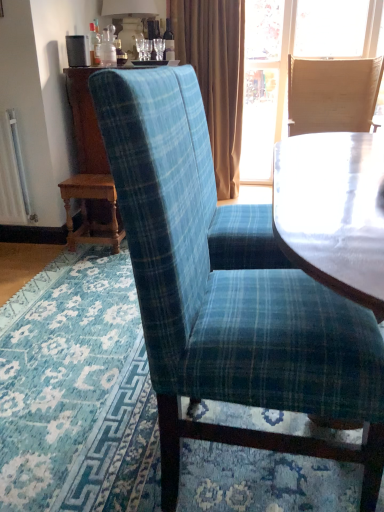
Question: Can you confirm if brown velvet curtain at upper center is thinner than light brown woven chair at upper right, acting as the second chair starting from the left?

Choices:
 (A) yes
 (B) no

Answer: (A)

Question: Is brown velvet curtain at upper center facing away from light brown woven chair at upper right, which ranks as the first chair in top-to-bottom order?

Choices:
 (A) no
 (B) yes

Answer: (A)

Question: Is brown velvet curtain at upper center located outside light brown woven chair at upper right, acting as the first chair starting from the back?

Choices:
 (A) yes
 (B) no

Answer: (A)

Question: Is light brown woven chair at upper right, which is the 1th chair in right-to-left order, surrounded by brown velvet curtain at upper center?

Choices:
 (A) yes
 (B) no

Answer: (B)

Question: From a real-world perspective, is brown velvet curtain at upper center below light brown woven chair at upper right, acting as the second chair starting from the left?

Choices:
 (A) no
 (B) yes

Answer: (A)

Question: Would you say white ceramic lamp at upper center is inside or outside blue plaid fabric chair at center, the first chair when ordered from front to back?

Choices:
 (A) outside
 (B) inside

Answer: (A)

Question: Based on their sizes in the image, would you say white ceramic lamp at upper center is bigger or smaller than blue plaid fabric chair at center, the 2th chair viewed from the top?

Choices:
 (A) big
 (B) small

Answer: (B)

Question: In terms of height, does white ceramic lamp at upper center look taller or shorter compared to blue plaid fabric chair at center, the 2th chair viewed from the top?

Choices:
 (A) short
 (B) tall

Answer: (A)

Question: From a real-world perspective, is white ceramic lamp at upper center above or below blue plaid fabric chair at center, the second chair viewed from the right?

Choices:
 (A) above
 (B) below

Answer: (A)

Question: In terms of height, does blue plaid fabric chair at center, the 2th chair viewed from the top, look taller or shorter compared to light brown woven chair at upper right, which is the 1th chair in right-to-left order?

Choices:
 (A) tall
 (B) short

Answer: (A)

Question: From a real-world perspective, is blue plaid fabric chair at center, the first chair when ordered from front to back, physically located above or below light brown woven chair at upper right, the 2th chair from the front?

Choices:
 (A) above
 (B) below

Answer: (B)

Question: Is blue plaid fabric chair at center, which is the second chair from back to front, to the left or to the right of light brown woven chair at upper right, which ranks as the 2th chair in bottom-to-top order, in the image?

Choices:
 (A) left
 (B) right

Answer: (A)

Question: Considering their positions, is blue plaid fabric chair at center, the 2th chair viewed from the top, located in front of or behind light brown woven chair at upper right, which ranks as the 2th chair in bottom-to-top order?

Choices:
 (A) behind
 (B) front

Answer: (B)

Question: In the image, is wooden table at lower left positioned in front of or behind white ceramic lamp at upper center?

Choices:
 (A) front
 (B) behind

Answer: (A)

Question: Looking at the image, does wooden table at lower left seem bigger or smaller compared to white ceramic lamp at upper center?

Choices:
 (A) big
 (B) small

Answer: (B)